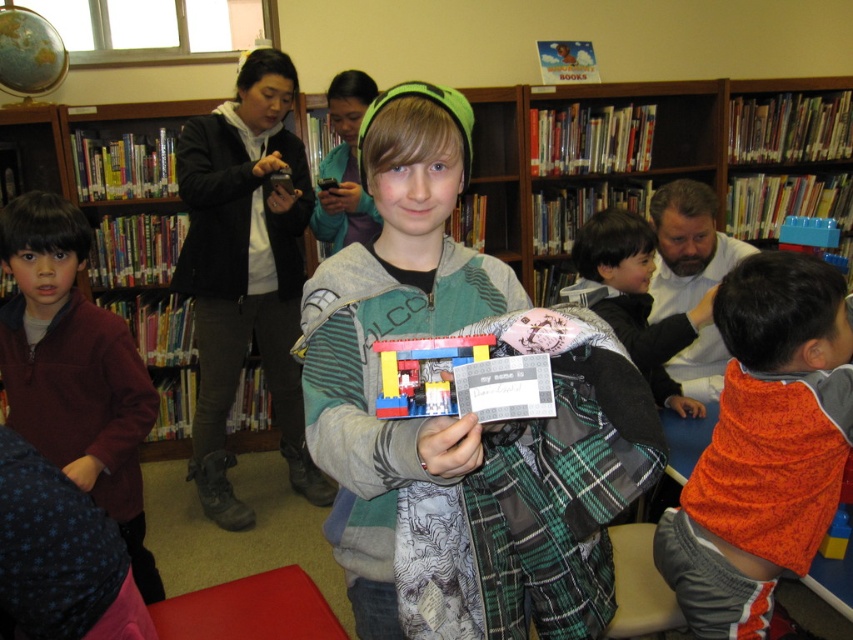
Question: Is wooden bookcase at upper center to the right of orange knitted sweater at lower right from the viewer's perspective?

Choices:
 (A) no
 (B) yes

Answer: (B)

Question: Which object is positioned closest to the green knit hat at center?

Choices:
 (A) orange fleece sweater at center
 (B) orange knitted sweater at lower right

Answer: (A)

Question: Which object appears farthest from the camera in this image?

Choices:
 (A) green knit hat at center
 (B) plaid fabric jacket at center
 (C) orange knitted sweater at lower right
 (D) wooden bookcase at upper center

Answer: (D)

Question: Can you confirm if orange knitted sweater at lower right is thinner than translucent plastic toy at center?

Choices:
 (A) no
 (B) yes

Answer: (A)

Question: Estimate the real-world distances between objects in this image. Which object is farther from the translucent plastic toy at center?

Choices:
 (A) plaid fabric jacket at center
 (B) wooden bookcase at upper center
 (C) orange knitted sweater at lower right

Answer: (B)

Question: Is wooden bookcase at upper center behind orange knitted sweater at lower right?

Choices:
 (A) no
 (B) yes

Answer: (B)